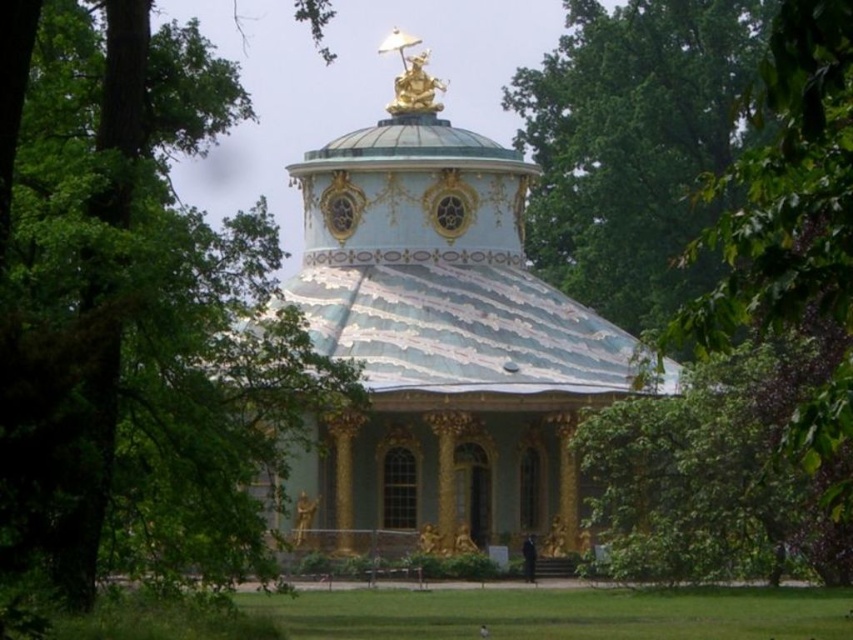
Question: Among these points, which one is farthest from the camera?

Choices:
 (A) (309, 168)
 (B) (602, 234)

Answer: (B)

Question: Which of the following is the farthest from the observer?

Choices:
 (A) (631, 136)
 (B) (103, 243)
 (C) (486, 493)

Answer: (A)

Question: Is porcelain dome at center in front of green leafy tree at upper center?

Choices:
 (A) yes
 (B) no

Answer: (A)

Question: Which object appears closest to the camera in this image?

Choices:
 (A) porcelain dome at center
 (B) green leafy tree at upper left

Answer: (B)

Question: Does green leafy tree at upper left appear under green leafy tree at upper center?

Choices:
 (A) yes
 (B) no

Answer: (A)

Question: Does green leafy tree at upper left have a lesser width compared to porcelain dome at center?

Choices:
 (A) yes
 (B) no

Answer: (A)